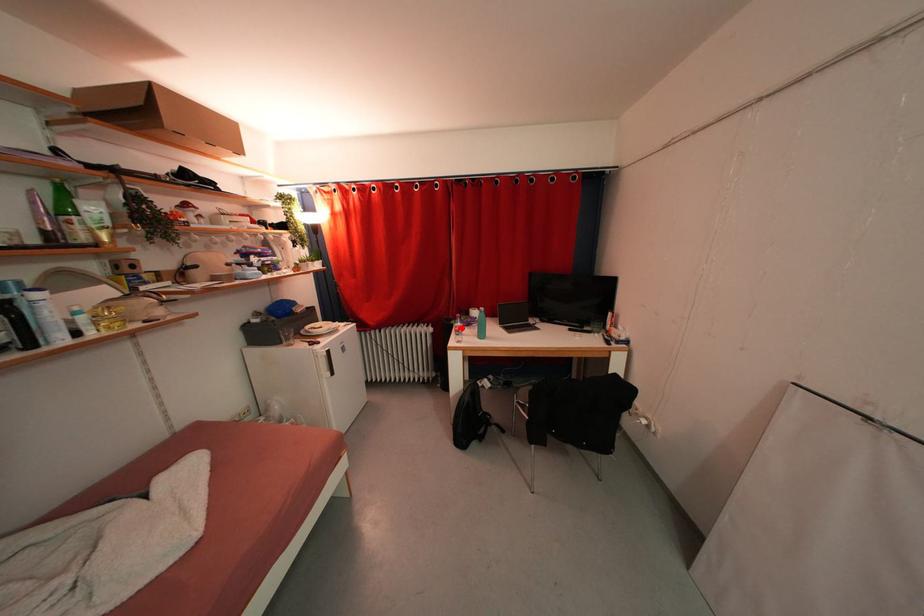
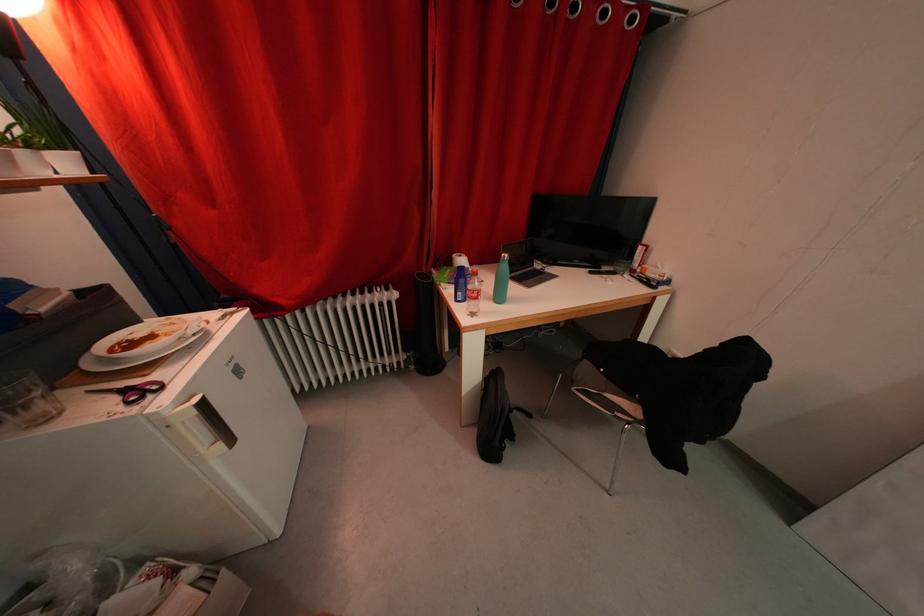
Question: I am providing you with two images of the same scene from different viewpoints. A red point is marked on the first image. Can you still see the location of the red point in image 2?

Choices:
 (A) Yes
 (B) No

Answer: (A)